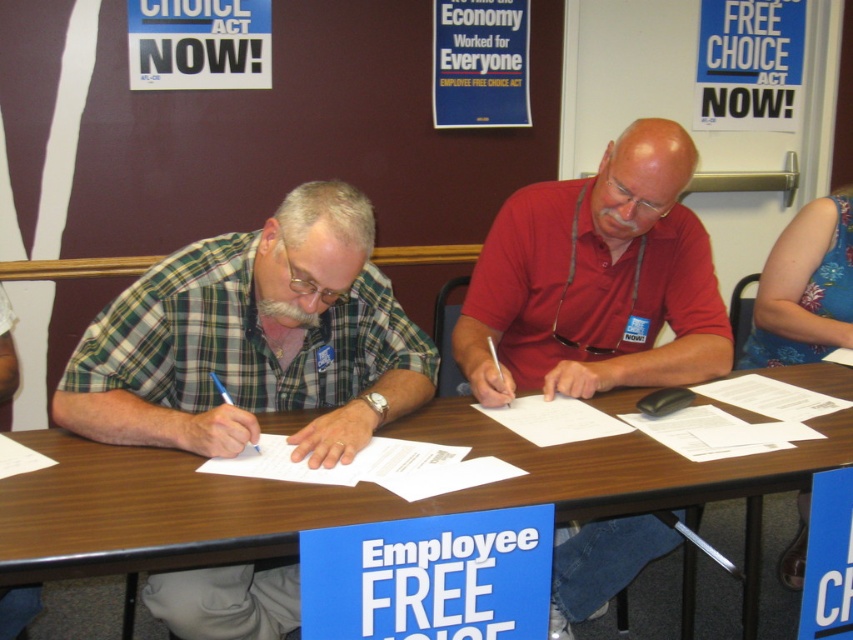
Question: Estimate the real-world distances between objects in this image. Which object is farther from the white paper at center?

Choices:
 (A) brown wood table at center
 (B) matte red shirt at center
 (C) green plaid shirt at left

Answer: (B)

Question: Which point is closer to the camera?

Choices:
 (A) matte red shirt at center
 (B) green plaid shirt at left

Answer: (B)

Question: Which of these objects is positioned closest to the green plaid shirt at left?

Choices:
 (A) matte red shirt at center
 (B) white paper at center
 (C) brown wood table at center

Answer: (B)

Question: Can you confirm if green plaid shirt at left is smaller than matte red shirt at center?

Choices:
 (A) yes
 (B) no

Answer: (A)

Question: Can you confirm if green plaid shirt at left is positioned below white paper at center?

Choices:
 (A) no
 (B) yes

Answer: (A)

Question: Does brown wood table at center appear on the left side of matte red shirt at center?

Choices:
 (A) no
 (B) yes

Answer: (B)